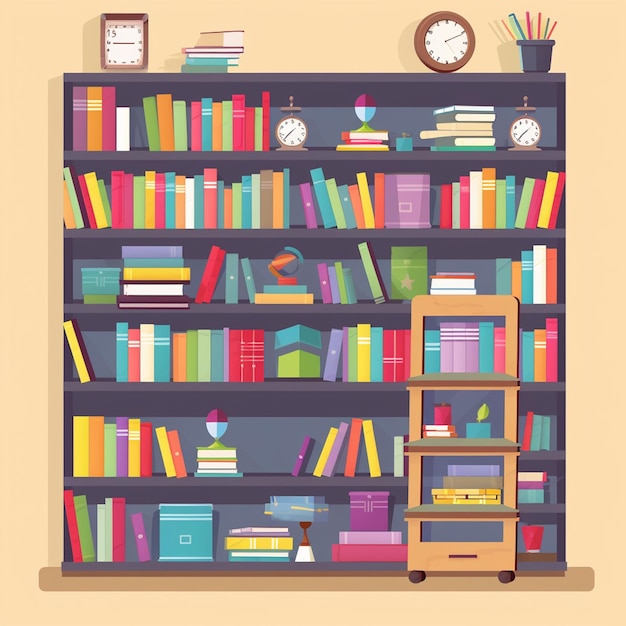
Locate an element on the screen. The height and width of the screenshot is (626, 626). books on top of bookcase is located at coordinates (233, 34), (230, 48), (227, 54), (223, 61), (216, 67).